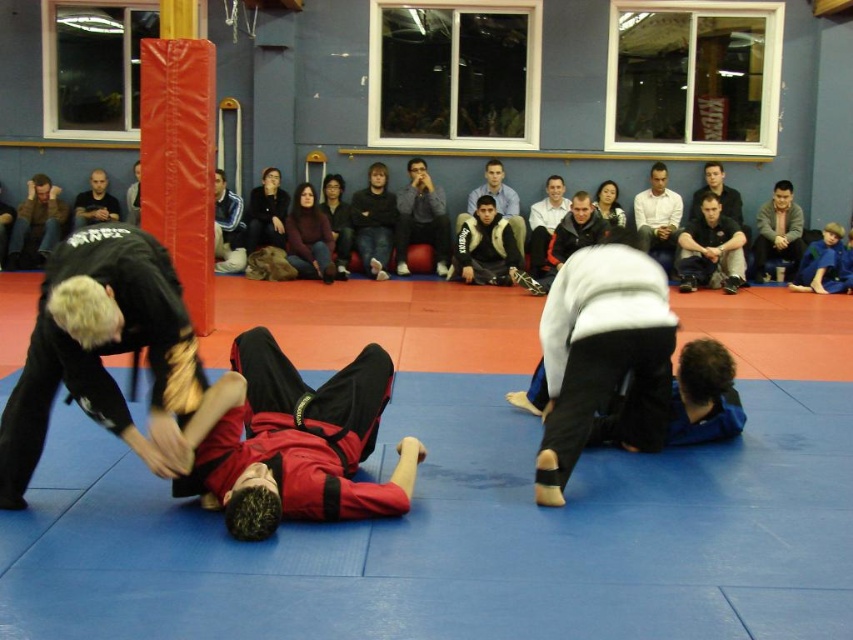
Question: Can you confirm if dark blue jeans at center is positioned above dark gray sweater at upper right?

Choices:
 (A) no
 (B) yes

Answer: (B)

Question: Estimate the real-world distances between objects in this image. Which object is farther from the black matte shirt at center?

Choices:
 (A) white shirt at upper center
 (B) dark gray sweater at center
 (C) dark gray fleece jacket at center
 (D) brown leather jacket at left

Answer: (A)

Question: Among these points, which one is farthest from the camera?

Choices:
 (A) (721, 228)
 (B) (413, 205)

Answer: (B)

Question: Considering the real-world distances, which object is farthest from the dark gray sweater at upper right?

Choices:
 (A) dark blue jeans at center
 (B) white shirt at upper center
 (C) dark gray fleece jacket at center

Answer: (A)

Question: Can you confirm if black matte uniform at center is positioned to the left of dark gray sweater at upper right?

Choices:
 (A) yes
 (B) no

Answer: (A)

Question: Does dark gray fabric shirt at center have a greater width compared to dark gray sweater at center?

Choices:
 (A) no
 (B) yes

Answer: (B)